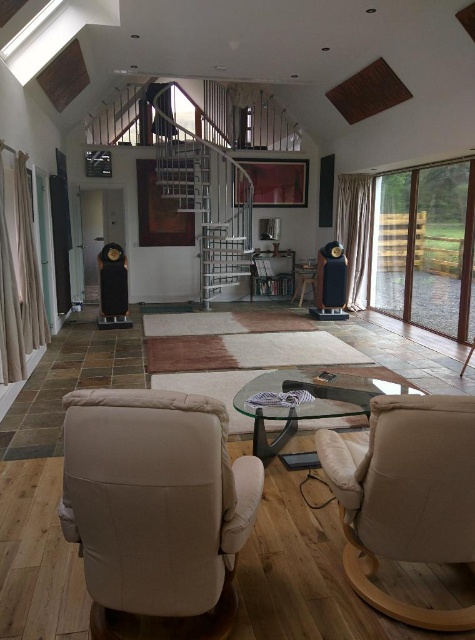
Question: Which point is farther from the camera taking this photo?

Choices:
 (A) (379, 288)
 (B) (376, 452)
 (C) (323, 410)

Answer: (A)

Question: Which point is closer to the camera?

Choices:
 (A) (258, 493)
 (B) (418, 312)
 (C) (364, 493)

Answer: (C)

Question: Considering the real-world distances, which object is farthest from the beige fabric armchair at lower left?

Choices:
 (A) transparent glass coffee table at center
 (B) beige leather armchair at lower right

Answer: (A)

Question: Does beige fabric armchair at lower left have a lesser width compared to beige leather armchair at lower right?

Choices:
 (A) no
 (B) yes

Answer: (A)

Question: Is beige leather armchair at lower right closer to camera compared to transparent glass coffee table at center?

Choices:
 (A) no
 (B) yes

Answer: (B)

Question: Does beige leather armchair at lower right have a greater width compared to transparent glass coffee table at center?

Choices:
 (A) no
 (B) yes

Answer: (A)